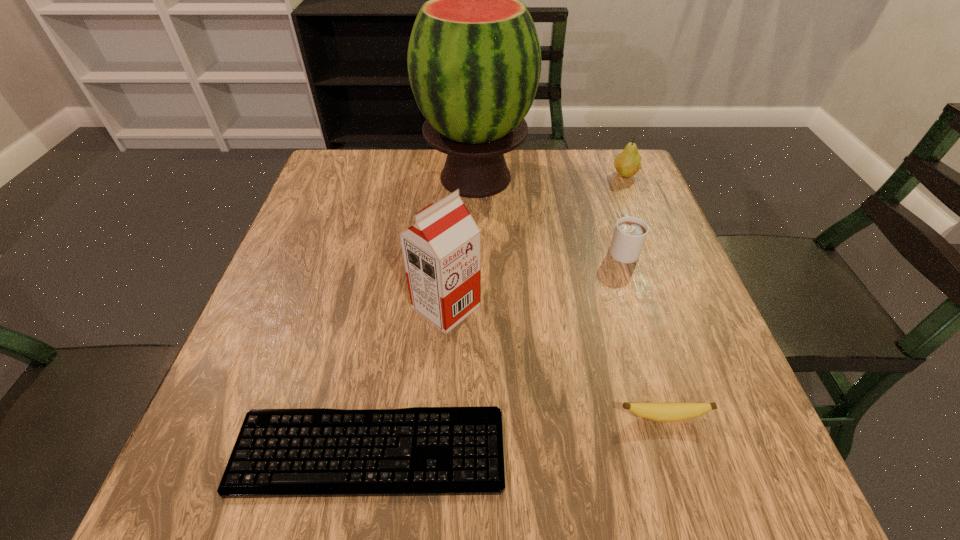
Locate an element on the screen. This screenshot has width=960, height=540. free spot between the fourth shortest object and the soya milk is located at coordinates (536, 241).

You are a GUI agent. You are given a task and a screenshot of the screen. Output one action in this format:
    pyautogui.click(x=<x>, y=<y>)
    Task: Click on the object that stands as the fifth closest to the soya milk
    Image resolution: width=960 pixels, height=540 pixels.
    Given the screenshot: What is the action you would take?
    pyautogui.click(x=628, y=163)

This screenshot has width=960, height=540. I want to click on the closest object relative to the fourth shortest object, so click(630, 233).

This screenshot has width=960, height=540. Find the location of `free location that satisfies the following two spatial constraints: 1. on the front side of the fifth tallest object; 2. on the left side of the watermelon`. free location that satisfies the following two spatial constraints: 1. on the front side of the fifth tallest object; 2. on the left side of the watermelon is located at coordinates (472, 417).

Identify the location of vacant space that satisfies the following two spatial constraints: 1. on the front side of the soya milk; 2. on the right side of the banana. The width and height of the screenshot is (960, 540). (439, 417).